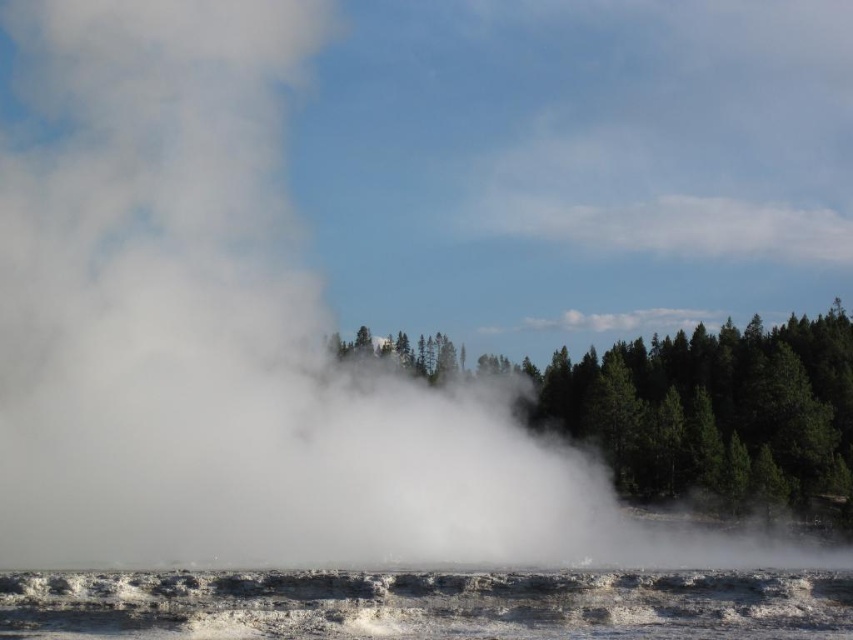
You are a hiker who wants to cross the area between the white frothy water at lower center and the green matte trees at center. Considering their sizes, which one do you think will be easier to navigate around?

The white frothy water at lower center has a smaller size compared to the green matte trees at center, so it would be easier to navigate around the white frothy water at lower center.

You are standing at the edge of the geothermal area and want to cross to the other side. There is white frothy water at lower center and green matte trees at center in your path. Which part of the path is narrower?

The white frothy water at lower center is narrower than the green matte trees at center because its width is less than the latter.

You are standing at the origin point in the image. Which direction should you move to reach the white frothy water at lower center?

The white frothy water at lower center is located at coordinates approximately 0.945 on the x axis and 0.501 on the y axis. From the origin point, you should move towards the right and slightly upwards to reach it.